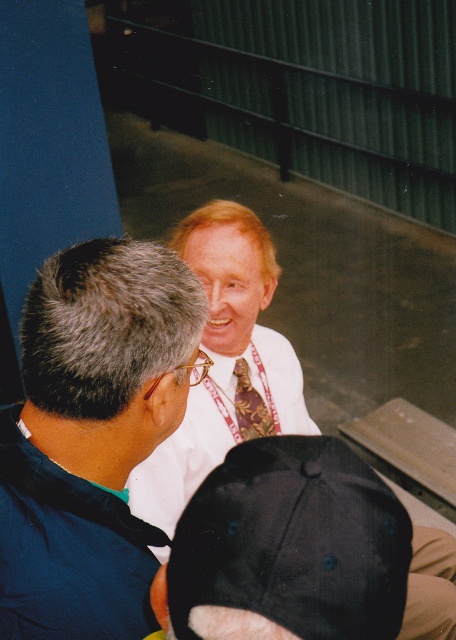
You are standing in the indoor setting shown in the image. There are two points marked in the scene. Which of the two points, point (x=227, y=360) or point (x=267, y=420), is closer to you?

Point (x=227, y=360) is closer to the viewer than point (x=267, y=420).

You are a photographer trying to capture a clear shot of the brown patterned tie at center. However, the white silk shirt at center is blocking your view. Can you adjust your position to see the tie without moving the shirt?

The white silk shirt at center is in front of the brown patterned tie at center, so moving your position might allow you to see around the shirt to view the tie. However, since the shirt is directly in front, it may still block the tie unless you move to the side or angle your camera appropriately.

You are an event organizer setting up a stage backdrop. You have two white items to place on the stage. You need to know which one is shorter between the white fabric at center and the white silk shirt at center so you can arrange them properly. Which one is shorter?

The white fabric at center is not as tall as the white silk shirt at center, so the white fabric at center is shorter.